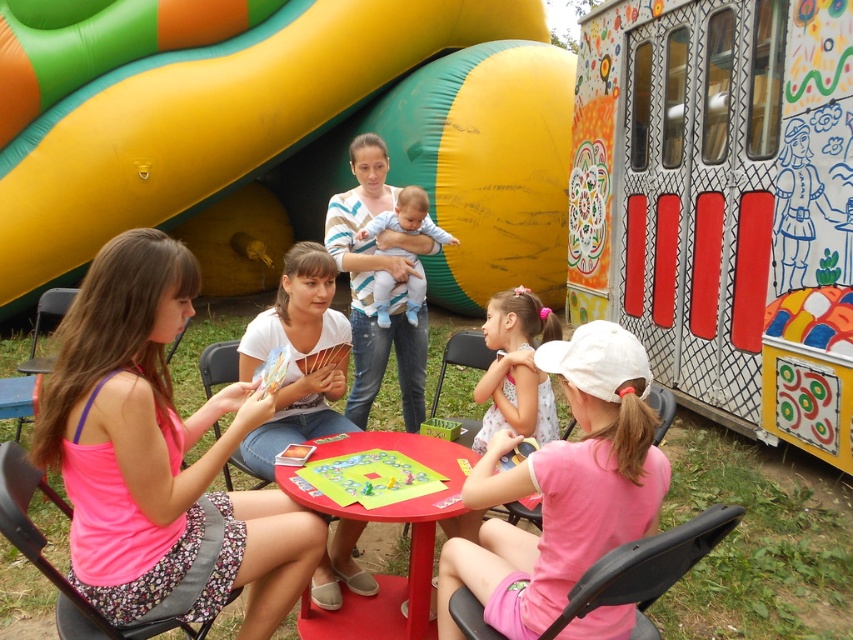
Question: Which object is the closest to the smooth plastic table at center?

Choices:
 (A) pink fabric dress at lower center
 (B) green matte board game at center

Answer: (B)

Question: Which object appears closest to the camera in this image?

Choices:
 (A) green matte board game at center
 (B) striped cotton shirt at center
 (C) pink fabric dress at lower center

Answer: (C)

Question: Is yellow rubber slide at upper left closer to camera compared to green matte board game at center?

Choices:
 (A) yes
 (B) no

Answer: (B)

Question: Considering the relative positions of yellow rubber slide at upper left and smooth plastic table at center in the image provided, where is yellow rubber slide at upper left located with respect to smooth plastic table at center?

Choices:
 (A) left
 (B) right

Answer: (A)

Question: Is pink fabric dress at lower left smaller than smooth plastic table at center?

Choices:
 (A) yes
 (B) no

Answer: (B)

Question: Which of these objects is positioned closest to the light blue cotton baby at center?

Choices:
 (A) pink fabric dress at lower center
 (B) pink fabric dress at lower left
 (C) green matte board game at center

Answer: (C)